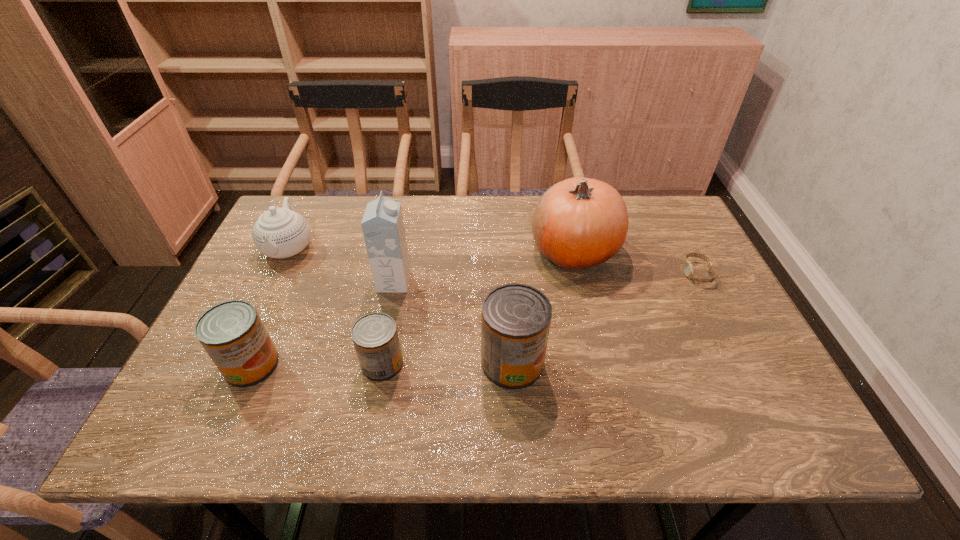
The height and width of the screenshot is (540, 960). In order to click on the third closest object to the carton in this screenshot , I will do `click(515, 318)`.

Identify the location of the second closest can relative to the second shortest object. (232, 333).

Find the location of `can object that ranks as the second closest to the carton`. can object that ranks as the second closest to the carton is located at coordinates (515, 318).

Locate an element on the screen. This screenshot has width=960, height=540. free point that satisfies the following two spatial constraints: 1. on the front label of the carton; 2. on the left side of the fifth object from left to right is located at coordinates tap(378, 363).

The height and width of the screenshot is (540, 960). Identify the location of free point that satisfies the following two spatial constraints: 1. on the spout of the chinaware; 2. on the left side of the second shortest can. (232, 365).

Where is `vacant space that satisfies the following two spatial constraints: 1. on the front label of the fifth object from left to right; 2. on the left side of the carton`? vacant space that satisfies the following two spatial constraints: 1. on the front label of the fifth object from left to right; 2. on the left side of the carton is located at coordinates (378, 363).

The height and width of the screenshot is (540, 960). I want to click on vacant area in the image that satisfies the following two spatial constraints: 1. on the spout of the tallest can; 2. on the left side of the chinaware, so click(x=233, y=363).

Identify the location of blank space that satisfies the following two spatial constraints: 1. on the spout of the rightmost can; 2. on the left side of the chinaware. (233, 363).

This screenshot has height=540, width=960. I want to click on free space in the image that satisfies the following two spatial constraints: 1. on the spout of the second can from left to right; 2. on the right side of the chinaware, so click(233, 364).

Where is `free space that satisfies the following two spatial constraints: 1. on the back side of the second can from right to left; 2. on the right side of the leftmost can`? The image size is (960, 540). free space that satisfies the following two spatial constraints: 1. on the back side of the second can from right to left; 2. on the right side of the leftmost can is located at coordinates (252, 364).